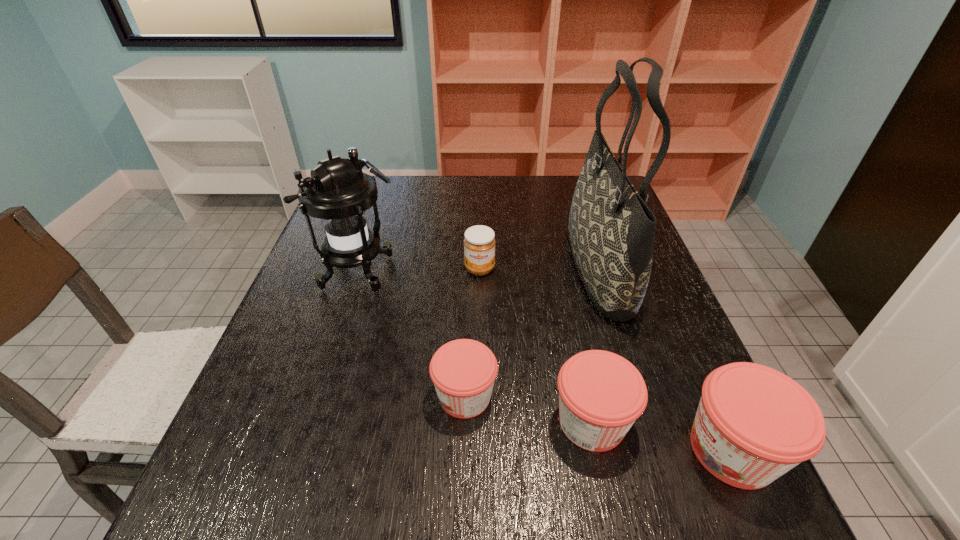
Please point a spot to add another jam on the left. Please provide its 2D coordinates. Your answer should be formatted as a tuple, i.e. [(x, y)], where the tuple contains the x and y coordinates of a point satisfying the conditions above.

[(349, 373)]